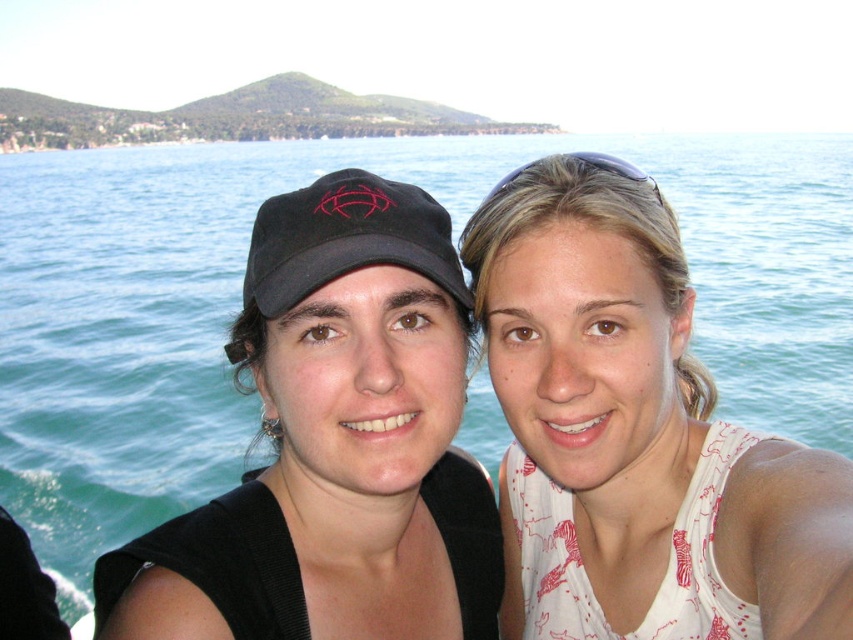
You are a photographer adjusting your camera settings. You notice the white printed tank top at center and the black fabric baseball cap at center in your frame. Which object should you focus on first to ensure sharpness if you want both to be in focus?

The white printed tank top at center is closer to the viewer than the black fabric baseball cap at center. To ensure both are in focus, focus on the object that is in the middle distance between them or use a smaller aperture for a deeper depth of field.

You are a photographer trying to capture a clear shot of both the black matte cap at center and the black fabric baseball cap at center. Which cap should you focus on first to ensure it appears sharp in the photo?

You should focus on the black matte cap at center first because it is closer to the viewer than the black fabric baseball cap at center, ensuring it stays sharp while adjusting focus for the other cap.

You are a photographer trying to capture a closeup of the white printed tank top at center and the black fabric baseball cap at center. Given that the camera can only focus on objects within a 30 cm width, will both items fit within the frame?

The white printed tank top at center is narrower than the black fabric baseball cap at center. Since the camera requires both items to be within 30 cm width, and the total width of both items combined exceeds 30 cm, they might not fit within the frame. However, since the exact widths aren